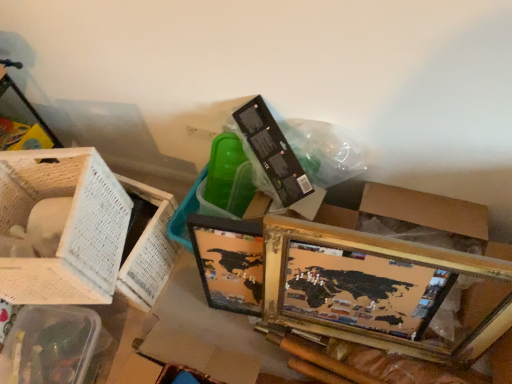
Question: From the image's perspective, is white woven basket at left, which appears as the 1th basket when viewed from the top, above or below clear plastic basket at lower left, which is counted as the 1th basket, starting from the bottom?

Choices:
 (A) below
 (B) above

Answer: (B)

Question: Which is correct: white woven basket at left, which appears as the 1th basket when viewed from the top, is inside clear plastic basket at lower left, which is counted as the 1th basket, starting from the bottom, or outside of it?

Choices:
 (A) outside
 (B) inside

Answer: (A)

Question: Estimate the real-world distances between objects in this image. Which object is closer to the clear plastic basket at lower left, which appears as the 2th basket when viewed from the top?

Choices:
 (A) gold-framed map at lower right
 (B) white woven basket at left, which is the second basket from bottom to top

Answer: (B)

Question: Which object is the farthest from the white woven basket at left, which appears as the 1th basket when viewed from the top?

Choices:
 (A) clear plastic basket at lower left, which is counted as the 1th basket, starting from the bottom
 (B) gold-framed map at lower right

Answer: (B)